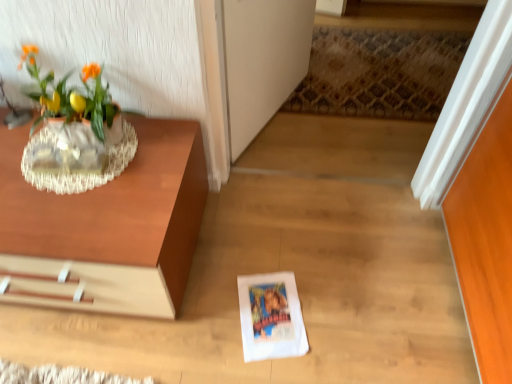
Where is `free spot to the right of clear glass vase at upper left`? The height and width of the screenshot is (384, 512). free spot to the right of clear glass vase at upper left is located at coordinates (157, 163).